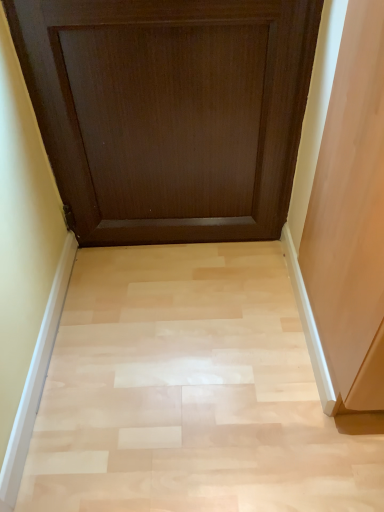
Question: Based on their positions, is dark wood door at upper center located to the left or right of light wood floor at center?

Choices:
 (A) left
 (B) right

Answer: (A)

Question: Does point (192, 182) appear closer or farther from the camera than point (104, 309)?

Choices:
 (A) closer
 (B) farther

Answer: (B)

Question: From the image's perspective, is dark wood door at upper center above or below light wood floor at center?

Choices:
 (A) above
 (B) below

Answer: (A)

Question: From a real-world perspective, is light wood floor at center physically located above or below dark wood door at upper center?

Choices:
 (A) above
 (B) below

Answer: (B)

Question: Is light wood floor at center wider or thinner than dark wood door at upper center?

Choices:
 (A) wide
 (B) thin

Answer: (A)

Question: Based on their sizes in the image, would you say light wood floor at center is bigger or smaller than dark wood door at upper center?

Choices:
 (A) small
 (B) big

Answer: (A)

Question: From the image's perspective, is light wood floor at center positioned above or below dark wood door at upper center?

Choices:
 (A) below
 (B) above

Answer: (A)